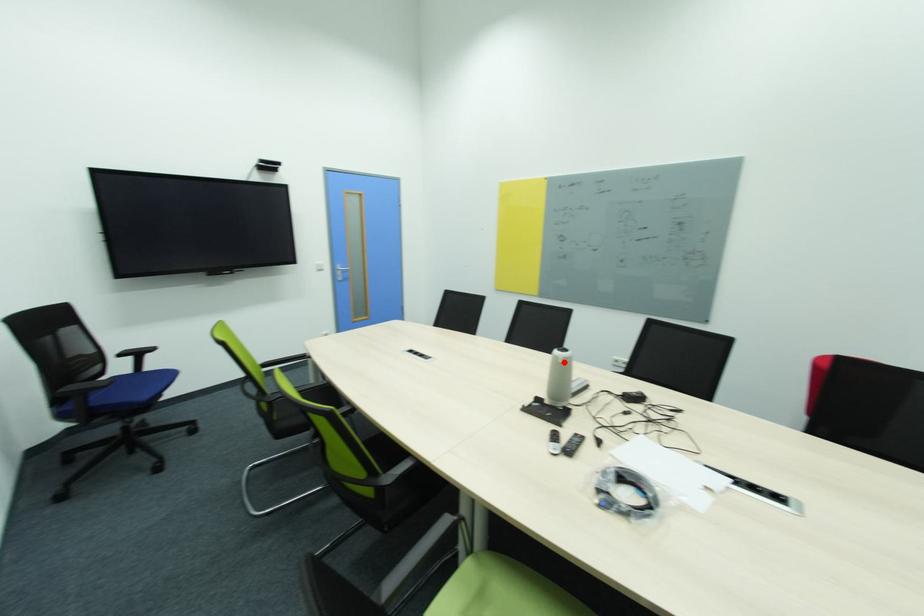
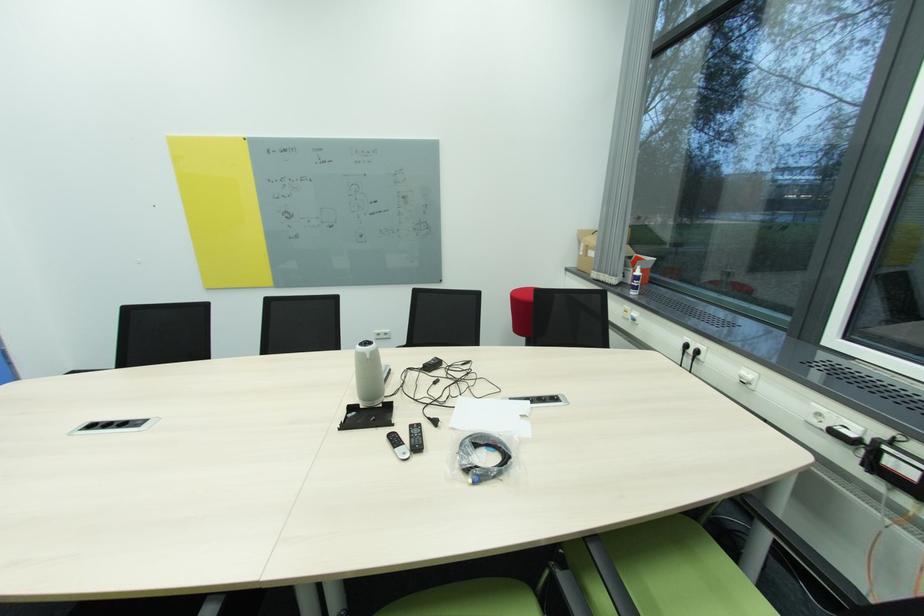
Question: I am providing you with two images of the same scene from different viewpoints. In image1, a red point is highlighted. Considering the same 3D point in image2, which of the following is correct?

Choices:
 (A) It is closer
 (B) It is farther

Answer: (A)